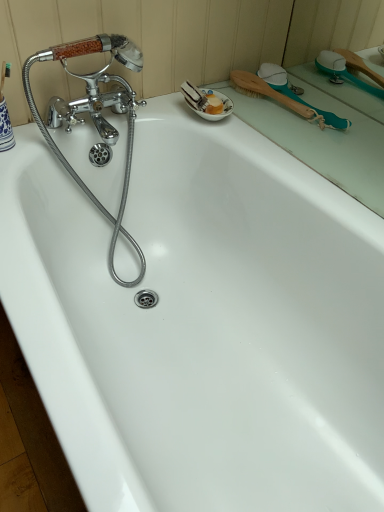
Locate an element on the screen. teal rubber shower brush at upper right is located at coordinates (296, 94).

Describe the element at coordinates (296, 94) in the screenshot. This screenshot has height=512, width=384. I see `teal rubber shower brush at upper right` at that location.

This screenshot has height=512, width=384. What do you see at coordinates (328, 102) in the screenshot? I see `teal plastic brush at upper right` at bounding box center [328, 102].

Locate an element on the screen. This screenshot has width=384, height=512. teal plastic brush at upper right is located at coordinates (328, 102).

Identify the location of teal rubber shower brush at upper right. Image resolution: width=384 pixels, height=512 pixels. (296, 94).

Is teal rubber shower brush at upper right to the left of teal plastic brush at upper right from the viewer's perspective?

Yes, teal rubber shower brush at upper right is to the left of teal plastic brush at upper right.

Considering the relative positions of teal rubber shower brush at upper right and teal plastic brush at upper right in the image provided, is teal rubber shower brush at upper right behind teal plastic brush at upper right?

Yes, teal rubber shower brush at upper right is further from the viewer.

Is point (302, 103) positioned after point (334, 32)?

No, (302, 103) is in front of (334, 32).

From the image's perspective, which object appears higher, teal rubber shower brush at upper right or teal plastic brush at upper right?

teal rubber shower brush at upper right.

From a real-world perspective, is teal rubber shower brush at upper right positioned over teal plastic brush at upper right based on gravity?

Yes, from a real-world perspective, teal rubber shower brush at upper right is on top of teal plastic brush at upper right.

Considering the relative sizes of teal rubber shower brush at upper right and teal plastic brush at upper right in the image provided, is teal rubber shower brush at upper right thinner than teal plastic brush at upper right?

No, teal rubber shower brush at upper right is not thinner than teal plastic brush at upper right.

Between teal rubber shower brush at upper right and teal plastic brush at upper right, which one has less height?

Standing shorter between the two is teal plastic brush at upper right.

In terms of size, does teal rubber shower brush at upper right appear bigger or smaller than teal plastic brush at upper right?

In the image, teal rubber shower brush at upper right appears to be smaller than teal plastic brush at upper right.

In the scene shown: Is teal rubber shower brush at upper right inside or outside of teal plastic brush at upper right?

teal rubber shower brush at upper right is located beyond the bounds of teal plastic brush at upper right.

Would you consider teal rubber shower brush at upper right to be distant from teal plastic brush at upper right?

They are positioned close to each other.

Is teal plastic brush at upper right at the back of teal rubber shower brush at upper right?

teal rubber shower brush at upper right is not turned away from teal plastic brush at upper right.

Consider the image. Measure the distance between teal rubber shower brush at upper right and teal plastic brush at upper right.

A distance of 5.64 inches exists between teal rubber shower brush at upper right and teal plastic brush at upper right.

In order to click on mirror below the teal rubber shower brush at upper right (from a real-world perspective) in this screenshot , I will do `click(328, 102)`.

Between teal plastic brush at upper right and teal rubber shower brush at upper right, which one appears on the left side from the viewer's perspective?

From the viewer's perspective, teal rubber shower brush at upper right appears more on the left side.

Between teal plastic brush at upper right and teal rubber shower brush at upper right, which one is positioned behind?

teal rubber shower brush at upper right is further from the camera.

Is point (320, 148) more distant than point (335, 115)?

No, (320, 148) is in front of (335, 115).

From the image's perspective, is teal plastic brush at upper right located above or below teal rubber shower brush at upper right?

Based on their image positions, teal plastic brush at upper right is located beneath teal rubber shower brush at upper right.

From a real-world perspective, relative to teal rubber shower brush at upper right, is teal plastic brush at upper right vertically above or below?

In terms of real-world spatial position, teal plastic brush at upper right is below teal rubber shower brush at upper right.

Which of these two, teal plastic brush at upper right or teal rubber shower brush at upper right, is wider?

teal rubber shower brush at upper right is wider.

Does teal plastic brush at upper right have a greater height compared to teal rubber shower brush at upper right?

No, teal plastic brush at upper right is not taller than teal rubber shower brush at upper right.

Considering the relative sizes of teal plastic brush at upper right and teal rubber shower brush at upper right in the image provided, is teal plastic brush at upper right smaller than teal rubber shower brush at upper right?

Actually, teal plastic brush at upper right might be larger than teal rubber shower brush at upper right.

Is teal plastic brush at upper right not within teal rubber shower brush at upper right?

Yes, teal plastic brush at upper right is located beyond the bounds of teal rubber shower brush at upper right.

Is teal plastic brush at upper right beside teal rubber shower brush at upper right?

No, teal plastic brush at upper right is not touching teal rubber shower brush at upper right.

Could you tell me if teal plastic brush at upper right is turned towards teal rubber shower brush at upper right?

No, teal plastic brush at upper right is not oriented towards teal rubber shower brush at upper right.

I want to click on shower located above the teal plastic brush at upper right (from a real-world perspective), so click(296, 94).

Where is `mirror lying below the teal rubber shower brush at upper right (from the image's perspective)`? The image size is (384, 512). mirror lying below the teal rubber shower brush at upper right (from the image's perspective) is located at coordinates [x=328, y=102].

I want to click on shower on the left of teal plastic brush at upper right, so click(x=296, y=94).